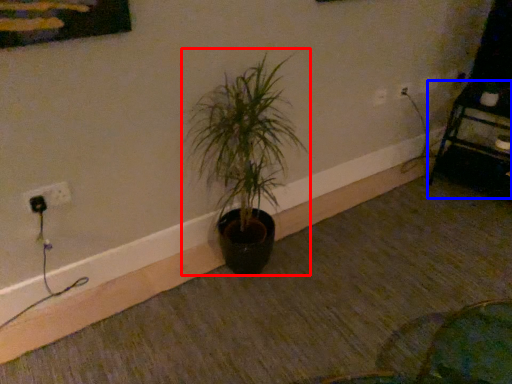
Question: Which point is further to the camera, houseplant (highlighted by a red box) or furniture (highlighted by a blue box)?

Choices:
 (A) houseplant
 (B) furniture

Answer: (B)